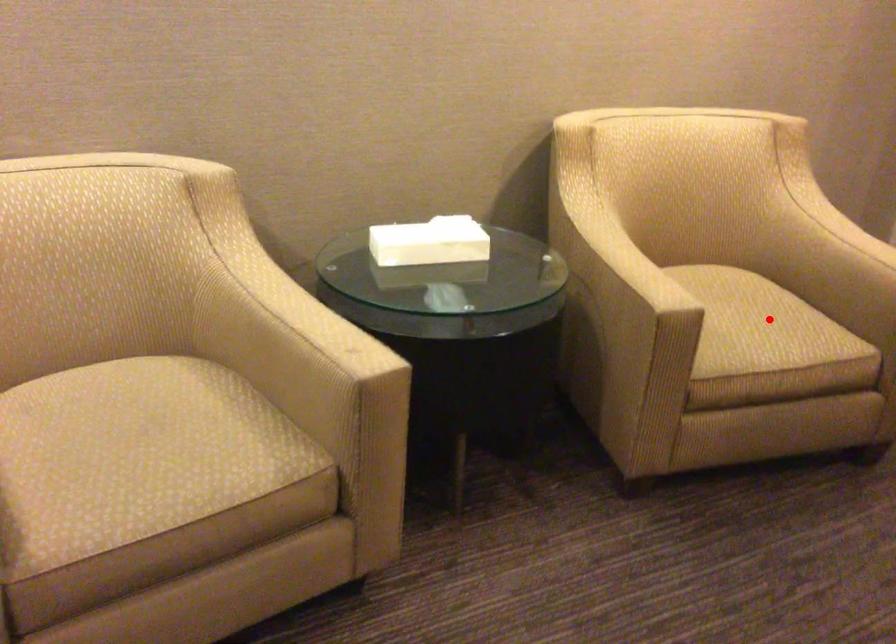
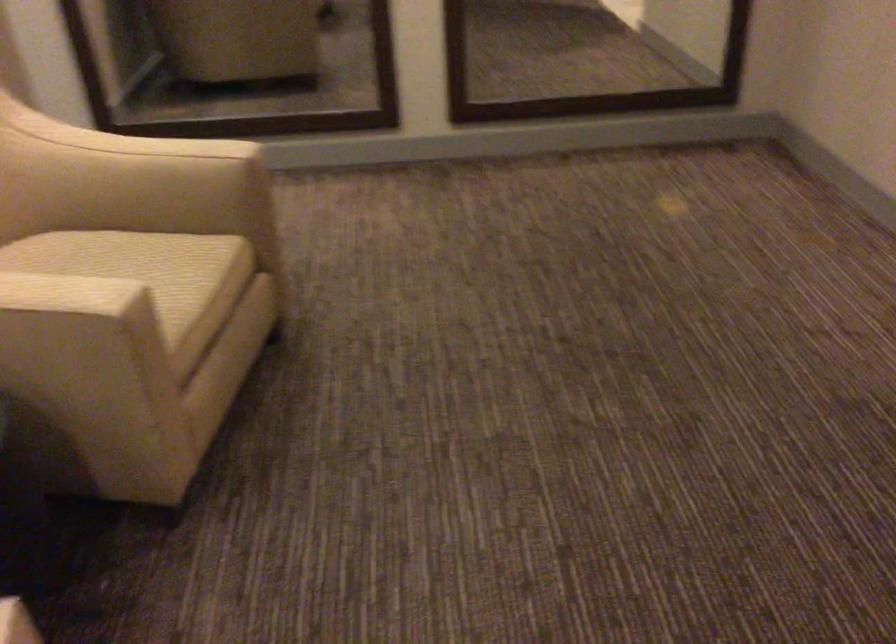
Where in the second image is the point corresponding to the highlighted location from the first image?

(143, 268)